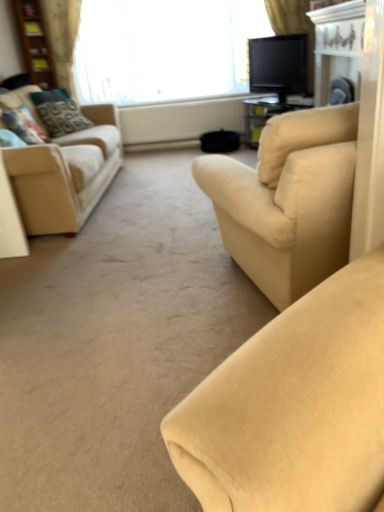
Question: Considering the relative sizes of patterned fabric pillow at left, placed as the first pillow when sorted from back to front, and silky beige curtain at upper center, which is counted as the 2th curtain, starting from the left, in the image provided, is patterned fabric pillow at left, placed as the first pillow when sorted from back to front, smaller than silky beige curtain at upper center, which is counted as the 2th curtain, starting from the left,?

Choices:
 (A) yes
 (B) no

Answer: (B)

Question: Is patterned fabric pillow at left, the 2th pillow from the front, aimed at silky beige curtain at upper center, the 1th curtain when ordered from right to left?

Choices:
 (A) no
 (B) yes

Answer: (A)

Question: Considering the relative sizes of patterned fabric pillow at left, the 2th pillow from the front, and silky beige curtain at upper center, the 1th curtain when ordered from right to left, in the image provided, is patterned fabric pillow at left, the 2th pillow from the front, thinner than silky beige curtain at upper center, the 1th curtain when ordered from right to left,?

Choices:
 (A) yes
 (B) no

Answer: (B)

Question: Is patterned fabric pillow at left, the 2th pillow from the front, oriented away from silky beige curtain at upper center, which is counted as the 2th curtain, starting from the left?

Choices:
 (A) no
 (B) yes

Answer: (A)

Question: Are patterned fabric pillow at left, placed as the first pillow when sorted from back to front, and silky beige curtain at upper center, the 1th curtain when ordered from right to left, far apart?

Choices:
 (A) no
 (B) yes

Answer: (B)

Question: Could silky beige curtain at upper center, the 1th curtain when ordered from right to left, be considered to be inside patterned fabric pillow at left, placed as the first pillow when sorted from back to front?

Choices:
 (A) no
 (B) yes

Answer: (A)

Question: Could black glossy tv at upper right be considered to be inside beige fabric couch at center, which is the 2th studio couch from left to right?

Choices:
 (A) yes
 (B) no

Answer: (B)

Question: From the image's perspective, would you say beige fabric couch at center, the 1th studio couch from the right, is shown under black glossy tv at upper right?

Choices:
 (A) no
 (B) yes

Answer: (B)

Question: Can you confirm if beige fabric couch at center, which is the 2th studio couch from left to right, is bigger than black glossy tv at upper right?

Choices:
 (A) yes
 (B) no

Answer: (A)

Question: Is beige fabric couch at center, the 1th studio couch from the right, closer to the viewer compared to black glossy tv at upper right?

Choices:
 (A) no
 (B) yes

Answer: (B)

Question: From a real-world perspective, is beige fabric couch at center, the 1th studio couch from the right, under black glossy tv at upper right?

Choices:
 (A) no
 (B) yes

Answer: (B)

Question: Is beige fabric couch at center, which is the 1th studio couch in front-to-back order, looking in the opposite direction of black glossy tv at upper right?

Choices:
 (A) yes
 (B) no

Answer: (B)

Question: From a real-world perspective, is patterned fabric pillow at left, placed as the first pillow when sorted from back to front, positioned under beige textured curtain at upper left, the 2th curtain from the right, based on gravity?

Choices:
 (A) no
 (B) yes

Answer: (B)